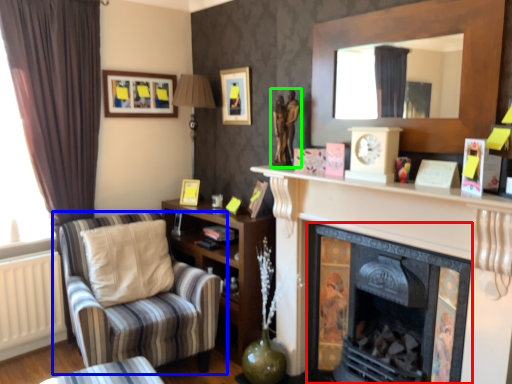
Question: Based on their relative distances, which object is nearer to fireplace (highlighted by a red box)? Choose from chair (highlighted by a blue box) and sculpture (highlighted by a green box).

Choices:
 (A) chair
 (B) sculpture

Answer: (B)